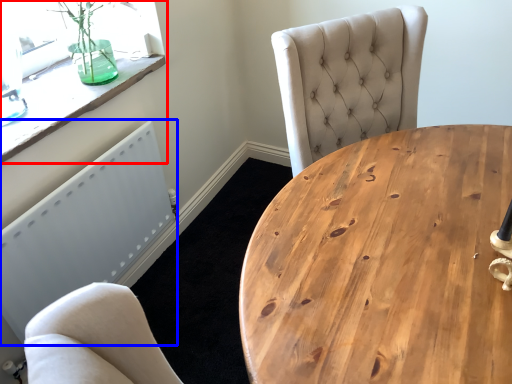
Question: Which point is further to the camera, window (highlighted by a red box) or radiator (highlighted by a blue box)?

Choices:
 (A) window
 (B) radiator

Answer: (A)